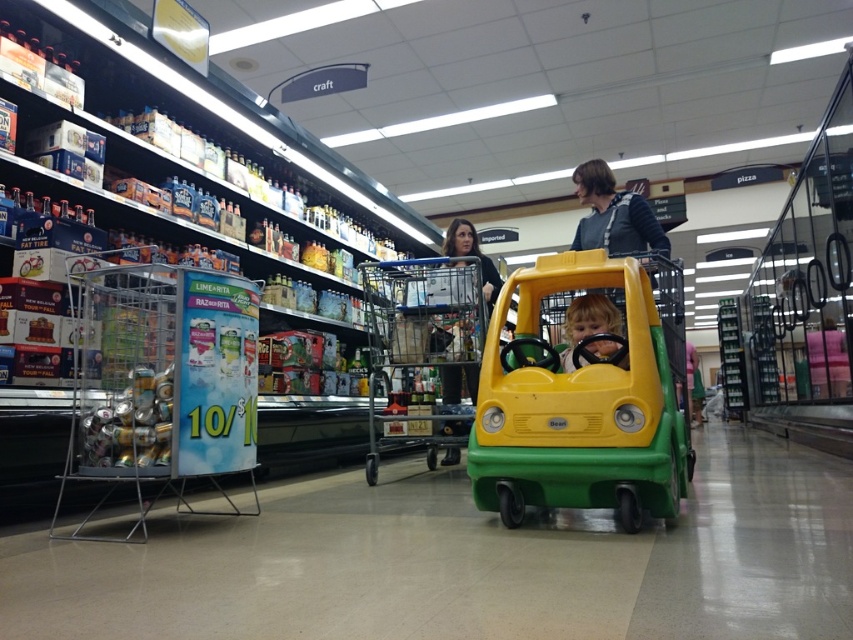
Question: Considering the relative positions of green plastic toy car at center and matte black shirt at center in the image provided, where is green plastic toy car at center located with respect to matte black shirt at center?

Choices:
 (A) right
 (B) left

Answer: (A)

Question: Estimate the real-world distances between objects in this image. Which object is farther from the matte black shirt at center?

Choices:
 (A) smooth yellow steering wheel at center
 (B) metallic blue trolley at center
 (C) green plastic toy car at center
 (D) metallic silver trolley at left

Answer: (D)

Question: Is metallic silver trolley at left positioned before smooth yellow steering wheel at center?

Choices:
 (A) yes
 (B) no

Answer: (A)

Question: Is green plastic toy car at center to the left of metallic silver trolley at left from the viewer's perspective?

Choices:
 (A) no
 (B) yes

Answer: (A)

Question: Which point is farther to the camera?

Choices:
 (A) metallic blue trolley at center
 (B) matte black shirt at center
 (C) green plastic toy car at center
 (D) smooth yellow steering wheel at center

Answer: (A)

Question: Which of the following is the farthest from the observer?

Choices:
 (A) metallic blue trolley at center
 (B) metallic silver trolley at left
 (C) smooth yellow steering wheel at center
 (D) green plastic toy car at center

Answer: (A)